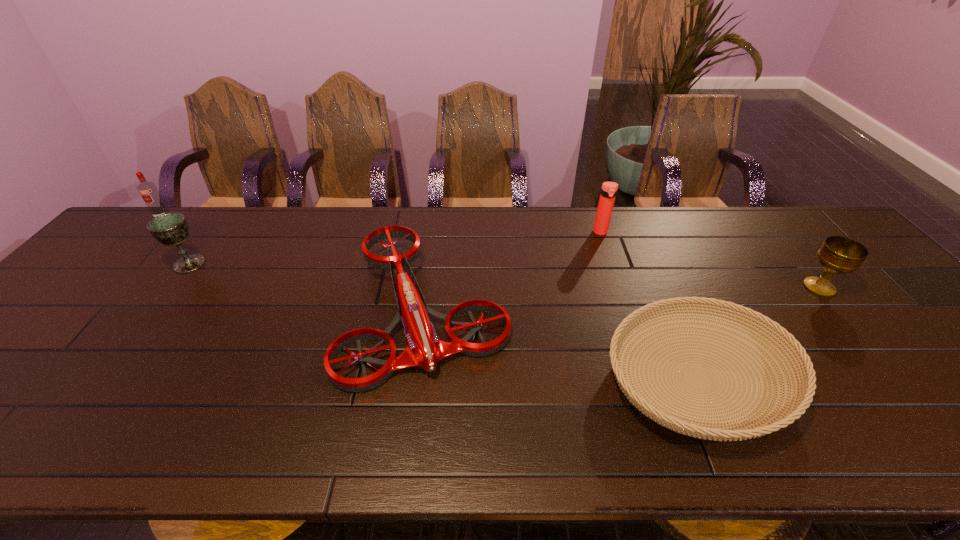
The height and width of the screenshot is (540, 960). I want to click on free location that satisfies the following two spatial constraints: 1. on the front label of the vodka; 2. on the right side of the shortest object, so click(11, 380).

You are a GUI agent. You are given a task and a screenshot of the screen. Output one action in this format:
    pyautogui.click(x=<x>, y=<y>)
    Task: Click on the vacant area in the image that satisfies the following two spatial constraints: 1. on the front side of the fifth object from right to left; 2. on the left side of the basket
    This screenshot has width=960, height=540.
    Given the screenshot: What is the action you would take?
    pyautogui.click(x=102, y=380)